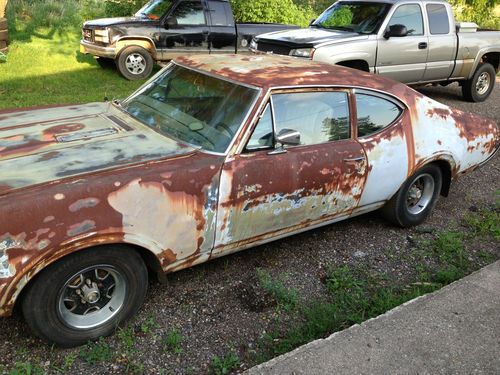
Find the location of `peeling paint`. peeling paint is located at coordinates (327, 191).